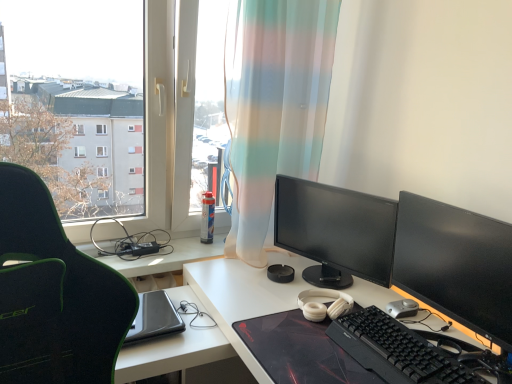
Where is `free space between white matte headphones at center and black textured mousepad at center`? The width and height of the screenshot is (512, 384). free space between white matte headphones at center and black textured mousepad at center is located at coordinates (272, 304).